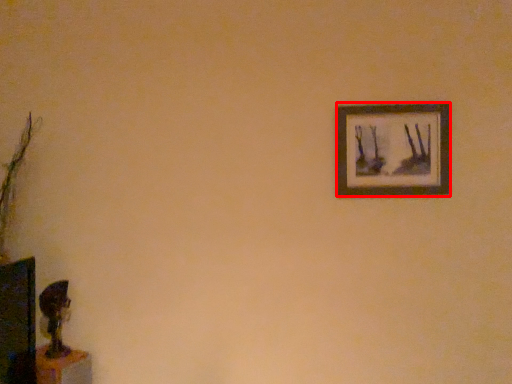
Question: From the image's perspective, considering the relative positions of picture frame (annotated by the red box) and table in the image provided, where is picture frame (annotated by the red box) located with respect to the staircase?

Choices:
 (A) above
 (B) below

Answer: (A)